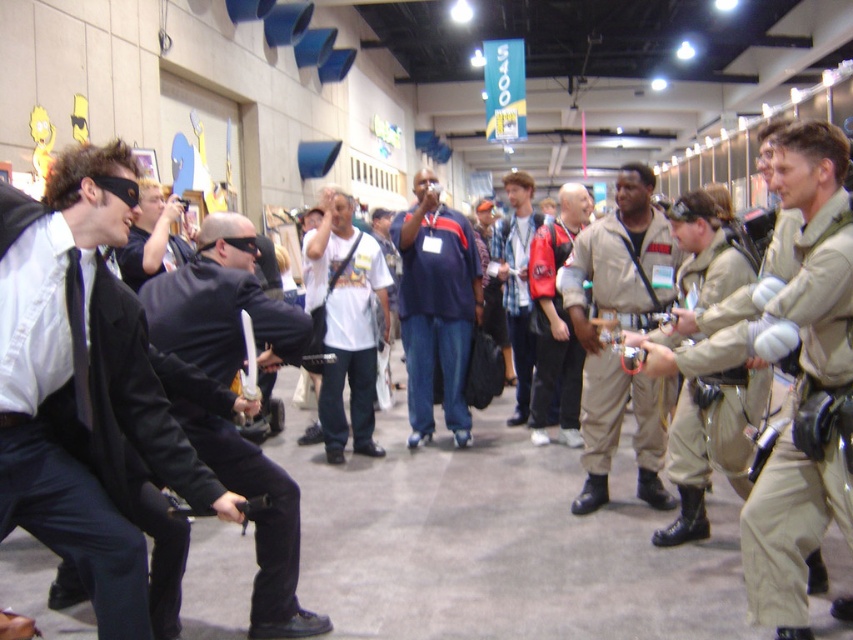
You are a photographer at the event and want to take a photo of the dark blue jersey at center without any obstructions. Is the matte black camera at center currently positioned in a way that it can capture the jersey without anything blocking it?

The matte black camera at center is behind dark blue jersey at center, so it would be obstructed. Move the camera forward so it is in front of the dark blue jersey at center to capture it without obstruction.